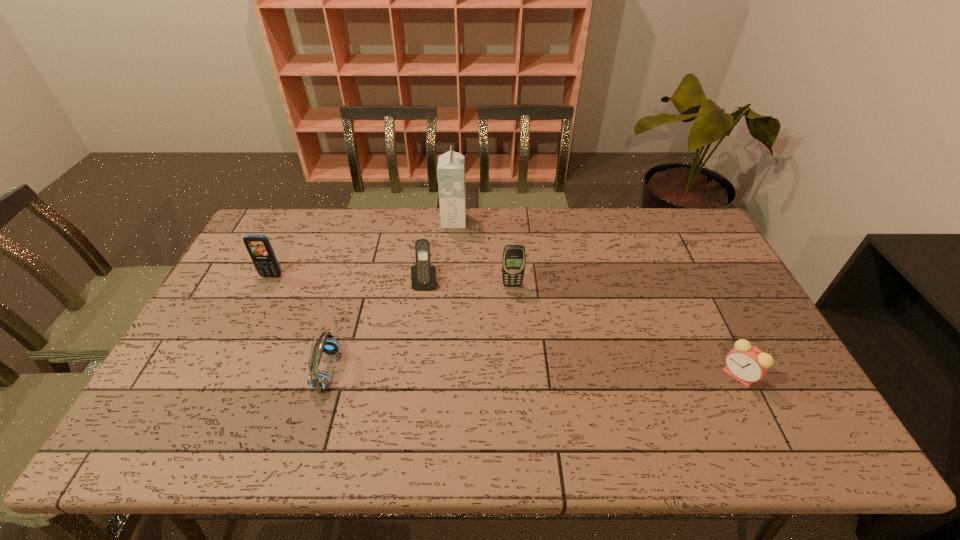
Find the location of a particular element. unoccupied area between the farthest object and the rightmost cellular telephone is located at coordinates (483, 253).

Find the location of a particular element. free space between the leftmost cellular telephone and the rightmost cellular telephone is located at coordinates (392, 281).

At what (x,y) coordinates should I click in order to perform the action: click on vacant space that is in between the rightmost cellular telephone and the second cellular telephone from right to left. Please return your answer as a coordinate pair (x, y). This screenshot has width=960, height=540. Looking at the image, I should click on (468, 284).

Locate an element on the screen. vacant area between the second object from right to left and the second cellular telephone from right to left is located at coordinates (468, 284).

Where is `vacant point located between the alarm clock and the tallest object`? vacant point located between the alarm clock and the tallest object is located at coordinates (596, 298).

Choose which object is the fourth nearest neighbor to the second cellular telephone from right to left. Please provide its 2D coordinates. Your answer should be formatted as a tuple, i.e. [(x, y)], where the tuple contains the x and y coordinates of a point satisfying the conditions above.

[(259, 248)]

Locate an element on the screen. object that ranks as the fourth closest to the second object from right to left is located at coordinates (747, 364).

This screenshot has width=960, height=540. Find the location of `the closest cellular telephone relative to the fifth object from right to left`. the closest cellular telephone relative to the fifth object from right to left is located at coordinates (423, 275).

You are a GUI agent. You are given a task and a screenshot of the screen. Output one action in this format:
    pyautogui.click(x=<x>, y=<y>)
    Task: Click on the cellular telephone that is the third closest one to the alarm clock
    Image resolution: width=960 pixels, height=540 pixels.
    Given the screenshot: What is the action you would take?
    pyautogui.click(x=259, y=248)

At what (x,y) coordinates should I click in order to perform the action: click on free point that satisfies the following two spatial constraints: 1. on the front-facing side of the second cellular telephone from right to left; 2. on the ear cups of the fifth object from right to left. Please return your answer as a coordinate pair (x, y). Looking at the image, I should click on (415, 369).